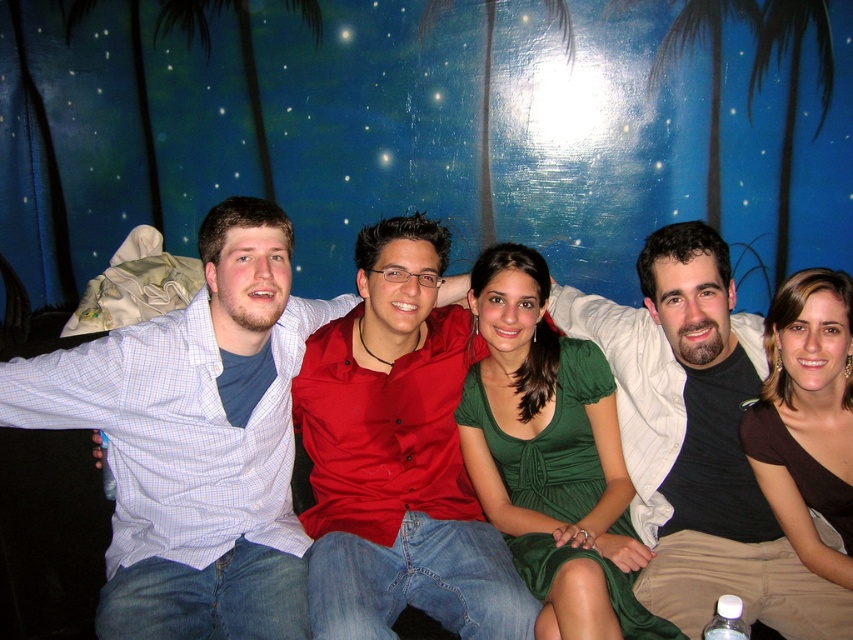
Question: Is blue painted wall at upper center bigger than light blue checkered shirt at center?

Choices:
 (A) no
 (B) yes

Answer: (B)

Question: Which of the following is the farthest from the observer?

Choices:
 (A) light blue checkered shirt at center
 (B) matte black shirt at center
 (C) blue painted wall at upper center

Answer: (C)

Question: Among these points, which one is nearest to the camera?

Choices:
 (A) (758, 541)
 (B) (106, 241)

Answer: (A)

Question: Considering the relative positions of blue painted wall at upper center and light blue checkered shirt at center in the image provided, where is blue painted wall at upper center located with respect to light blue checkered shirt at center?

Choices:
 (A) right
 (B) left

Answer: (A)

Question: Which of the following is the closest to the observer?

Choices:
 (A) (703, 488)
 (B) (474, 65)

Answer: (A)

Question: Does blue painted wall at upper center appear under matte black shirt at center?

Choices:
 (A) yes
 (B) no

Answer: (B)